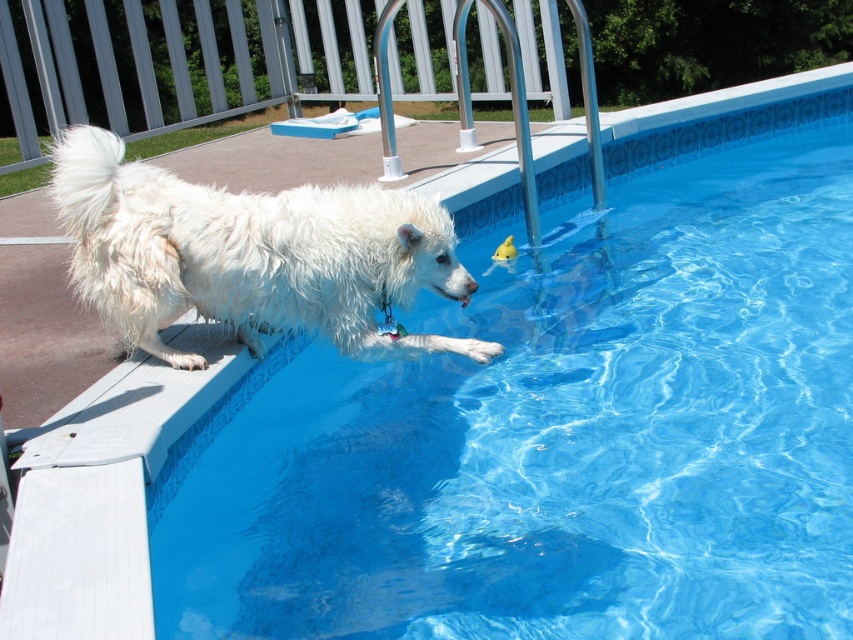
Question: Which point is closer to the camera?

Choices:
 (A) white fluffy dog at left
 (B) blue tile swimming pool at upper center

Answer: (B)

Question: Does blue tile swimming pool at upper center come in front of white fluffy dog at left?

Choices:
 (A) no
 (B) yes

Answer: (B)

Question: Is blue tile swimming pool at upper center in front of white fluffy dog at left?

Choices:
 (A) no
 (B) yes

Answer: (B)

Question: Which point appears closest to the camera in this image?

Choices:
 (A) (410, 204)
 (B) (225, 442)

Answer: (B)

Question: Is blue tile swimming pool at upper center behind white fluffy dog at left?

Choices:
 (A) yes
 (B) no

Answer: (B)